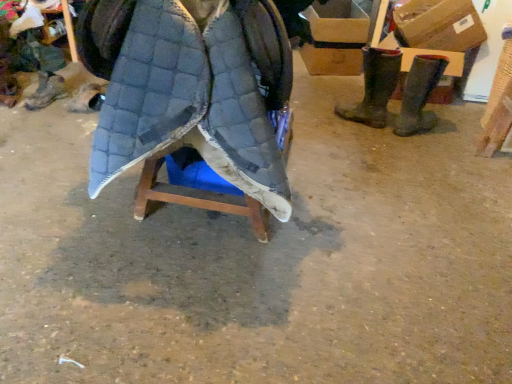
Question: Should I look upward or downward to see matte black boot at center, which is the 2th footwear in left-to-right order?

Choices:
 (A) down
 (B) up

Answer: (B)

Question: Can you confirm if brown rubber boots at right, arranged as the second footwear when viewed from the right, is wider than matte black boot at center, which is the 2th footwear in left-to-right order?

Choices:
 (A) yes
 (B) no

Answer: (A)

Question: Does brown rubber boots at right, arranged as the second footwear when viewed from the right, have a larger size compared to matte black boot at center, placed as the third footwear when sorted from right to left?

Choices:
 (A) yes
 (B) no

Answer: (A)

Question: Is brown rubber boots at right, arranged as the second footwear when viewed from the right, outside of matte black boot at center, placed as the third footwear when sorted from right to left?

Choices:
 (A) yes
 (B) no

Answer: (A)

Question: From the image's perspective, would you say brown rubber boots at right, arranged as the second footwear when viewed from the right, is shown under matte black boot at center, placed as the third footwear when sorted from right to left?

Choices:
 (A) no
 (B) yes

Answer: (A)

Question: From the image's perspective, is brown rubber boots at right, arranged as the second footwear when viewed from the right, on top of matte black boot at center, placed as the third footwear when sorted from right to left?

Choices:
 (A) yes
 (B) no

Answer: (A)

Question: From a real-world perspective, is brown rubber boots at right, arranged as the second footwear when viewed from the right, under matte black boot at center, which is the 2th footwear in left-to-right order?

Choices:
 (A) no
 (B) yes

Answer: (A)

Question: Does cardboard box at upper right, the 2th cardboard box from the left, have a smaller size compared to brown suede boots at right, acting as the fourth footwear starting from the left?

Choices:
 (A) no
 (B) yes

Answer: (A)

Question: Is cardboard box at upper right, which is counted as the 1th cardboard box, starting from the right, wider than brown suede boots at right, which ranks as the first footwear in right-to-left order?

Choices:
 (A) yes
 (B) no

Answer: (A)

Question: From the image's perspective, is cardboard box at upper right, which is counted as the 1th cardboard box, starting from the right, on brown suede boots at right, which ranks as the first footwear in right-to-left order?

Choices:
 (A) yes
 (B) no

Answer: (A)

Question: Is cardboard box at upper right, the 2th cardboard box from the left, positioned behind brown suede boots at right, which ranks as the first footwear in right-to-left order?

Choices:
 (A) no
 (B) yes

Answer: (B)

Question: Is cardboard box at upper right, placed as the 2th cardboard box when sorted from back to front, to the right of brown suede boots at right, acting as the fourth footwear starting from the left, from the viewer's perspective?

Choices:
 (A) no
 (B) yes

Answer: (B)

Question: Considering the relative sizes of cardboard box at upper right, placed as the 2th cardboard box when sorted from back to front, and brown suede boots at right, which ranks as the first footwear in right-to-left order, in the image provided, is cardboard box at upper right, placed as the 2th cardboard box when sorted from back to front, thinner than brown suede boots at right, which ranks as the first footwear in right-to-left order,?

Choices:
 (A) no
 (B) yes

Answer: (A)

Question: Is brown suede boots at right, acting as the fourth footwear starting from the left, wider than quilted fabric cloak at center?

Choices:
 (A) yes
 (B) no

Answer: (B)